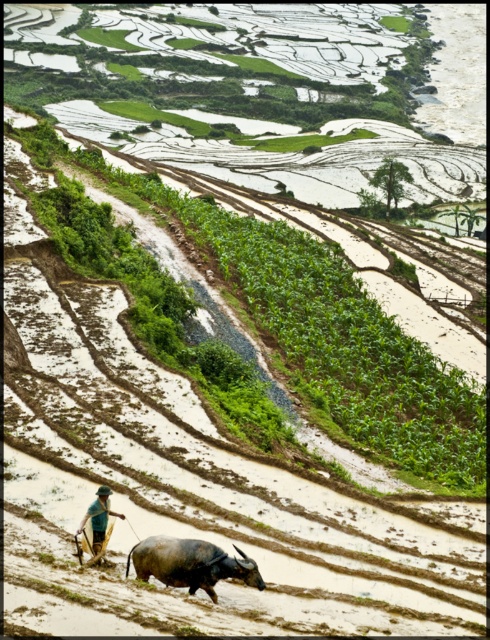
Can you confirm if dark gray textured bull at lower center is positioned below green fabric hat at lower center?

Yes.

Between dark gray textured bull at lower center and green fabric hat at lower center, which one is positioned lower?

dark gray textured bull at lower center

Does point (156, 579) come behind point (106, 502)?

That is False.

This screenshot has height=640, width=490. What are the coordinates of `dark gray textured bull at lower center` in the screenshot? It's located at (191, 563).